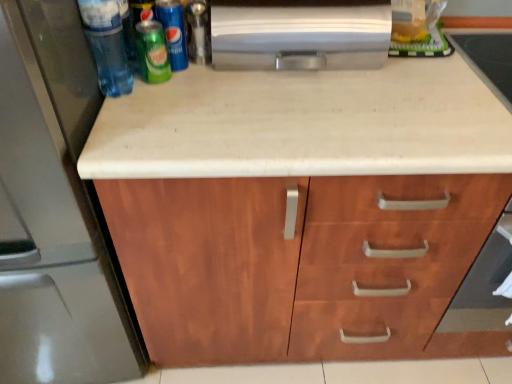
Where is `vacant space situated above wooden cabinet at center (from a real-world perspective)`? This screenshot has width=512, height=384. vacant space situated above wooden cabinet at center (from a real-world perspective) is located at coordinates (358, 92).